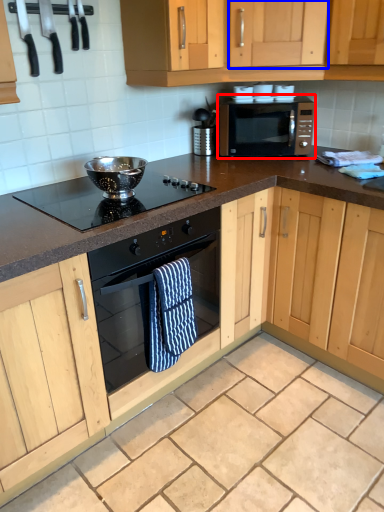
Question: Which of the following is the closest to the observer, microwave oven (highlighted by a red box) or cabinetry (highlighted by a blue box)?

Choices:
 (A) microwave oven
 (B) cabinetry

Answer: (B)